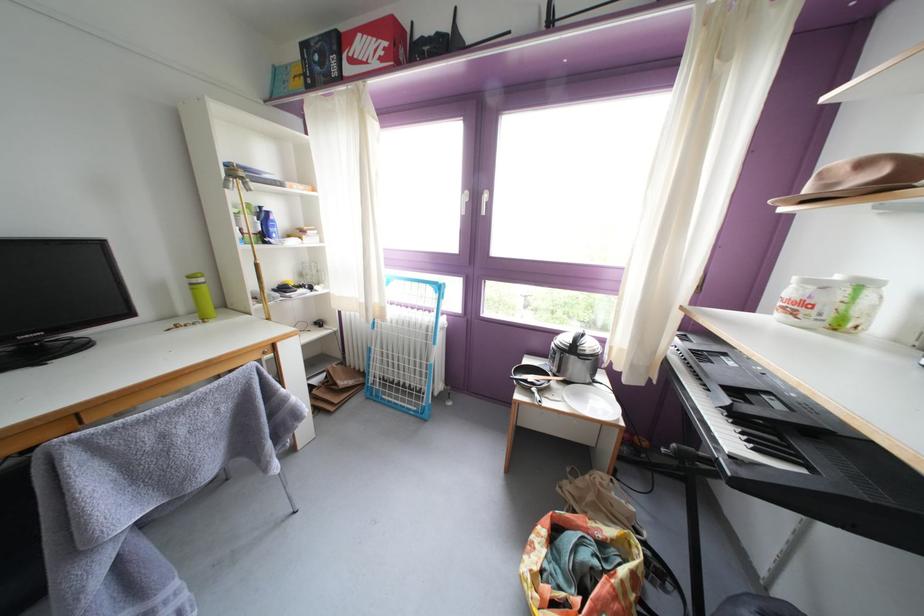
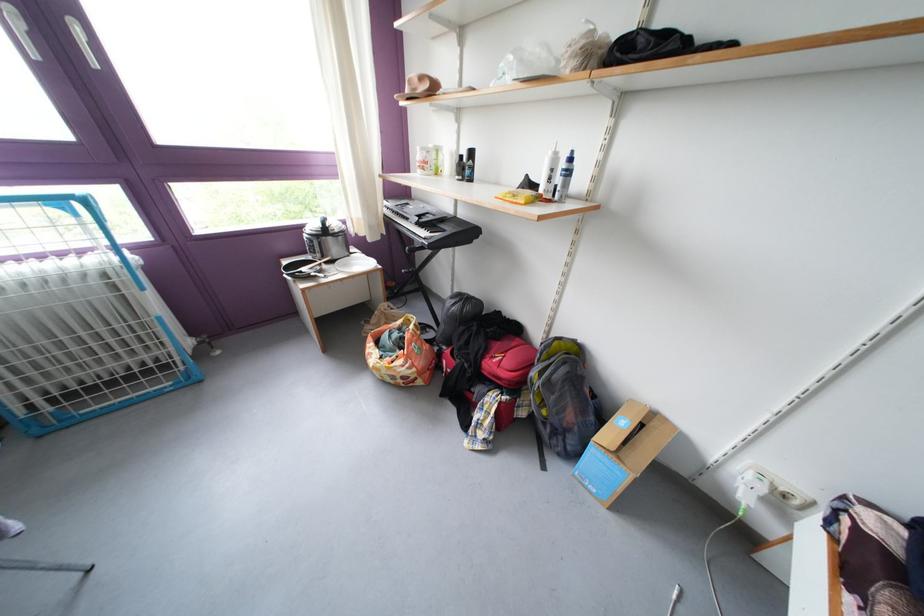
Locate, in the second image, the point that corresponds to pixel 577 389 in the first image.

(344, 267)